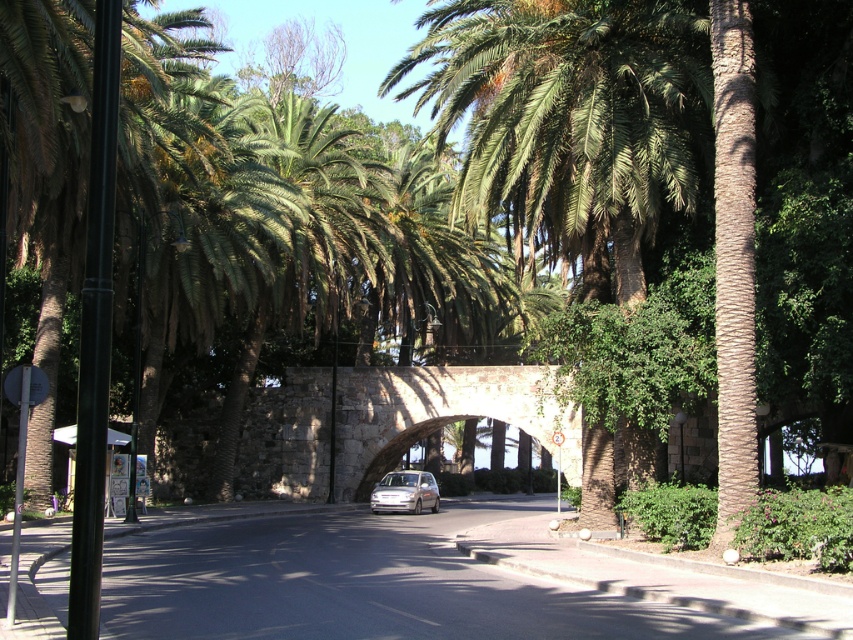
Question: Considering the real-world distances, which object is farthest from the satin silver car at center?

Choices:
 (A) stone archway at center
 (B) green leafy palm tree at center

Answer: (B)

Question: Observing the image, what is the correct spatial positioning of green leafy palm tree at center in reference to stone archway at center?

Choices:
 (A) below
 (B) above

Answer: (B)

Question: Can you confirm if green leafy palm tree at center is thinner than stone archway at center?

Choices:
 (A) yes
 (B) no

Answer: (A)

Question: Which object is the farthest from the green leafy palm tree at center?

Choices:
 (A) stone archway at center
 (B) satin silver car at center

Answer: (B)

Question: Is green leafy palm tree at center wider than satin silver car at center?

Choices:
 (A) no
 (B) yes

Answer: (B)

Question: Which point appears farthest from the camera in this image?

Choices:
 (A) tap(548, 83)
 (B) tap(439, 422)
 (C) tap(422, 481)

Answer: (B)